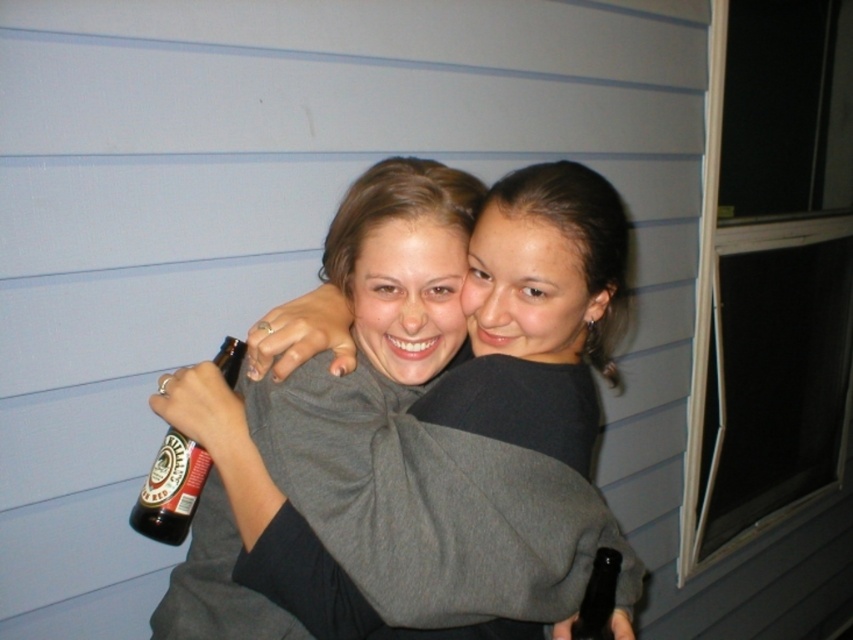
You are at a party and see two bottles, a brown glass beer bottle at lower left and a dark brown glass bottle at center. Which one is more to the left?

The brown glass beer bottle at lower left is more to the left.

You are a bartender who needs to place two bottles on a shelf. You have a brown glass beer bottle at lower left and a dark brown glass bottle at center. According to their positions in the image, which bottle should you place higher on the shelf?

The brown glass beer bottle at lower left should be placed higher on the shelf because it is positioned above the dark brown glass bottle at center in the image.

You are a photographer trying to capture a candid shot of the gray soft sweater at center and the dark brown glass bottle at center. Since you want to ensure both are in focus, you need to know their relative positions. Which object is located to the left of the other?

The gray soft sweater at center is positioned on the left side of dark brown glass bottle at center, so the gray soft sweater at center is to the left of the dark brown glass bottle at center.